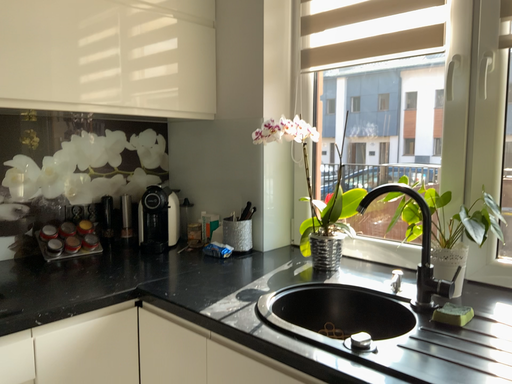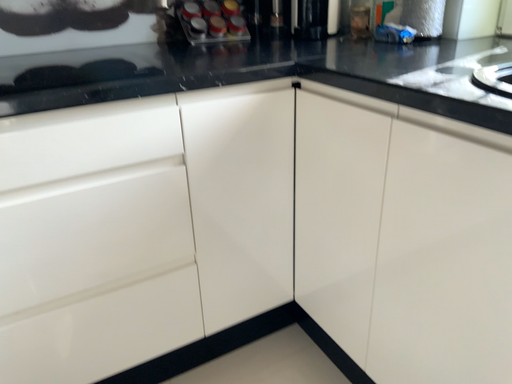
Question: Which way did the camera rotate in the video?

Choices:
 (A) rotated upward
 (B) rotated downward

Answer: (B)